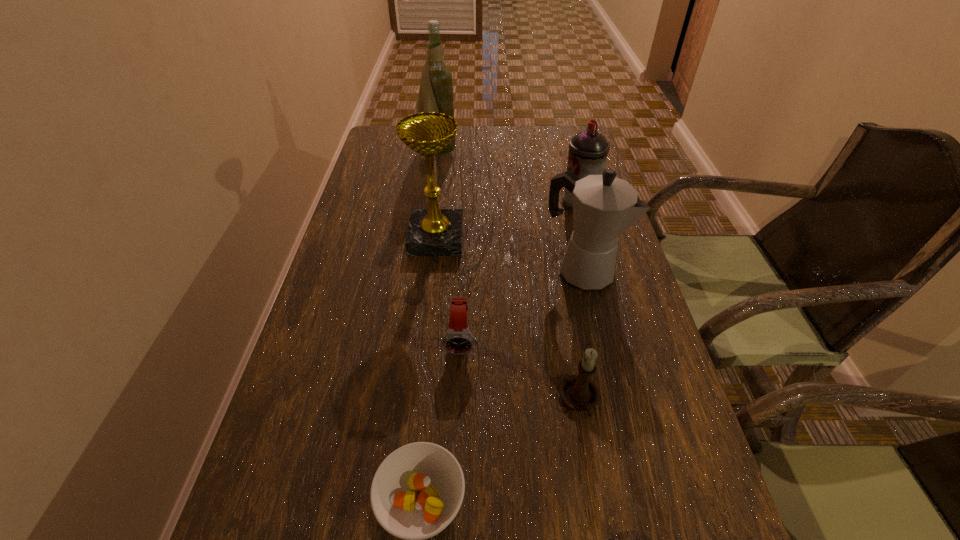
The image size is (960, 540). I want to click on object present at the far left corner, so click(x=436, y=94).

In the image, there is a desktop. Identify the location of vacant space at the far edge. (458, 150).

Locate an element on the screen. The image size is (960, 540). vacant space at the left edge of the desktop is located at coordinates (397, 183).

In the image, there is a desktop. Where is `free region at the right edge`? Image resolution: width=960 pixels, height=540 pixels. free region at the right edge is located at coordinates (646, 389).

Where is `blank region between the aerosol can and the fifth tallest object`? The width and height of the screenshot is (960, 540). blank region between the aerosol can and the fifth tallest object is located at coordinates (579, 302).

Where is `free spot between the award and the third nearest object`? Image resolution: width=960 pixels, height=540 pixels. free spot between the award and the third nearest object is located at coordinates (449, 289).

You are a GUI agent. You are given a task and a screenshot of the screen. Output one action in this format:
    pyautogui.click(x=<x>, y=<y>)
    Task: Click on the vacant region between the second shortest object and the coffeepot
    The image size is (960, 540).
    Given the screenshot: What is the action you would take?
    pyautogui.click(x=521, y=305)

Identify the location of free space between the award and the coffeepot. (509, 254).

Locate an element on the screen. This screenshot has width=960, height=540. empty location between the coffeepot and the wine bottle is located at coordinates (509, 212).

At what (x,y) coordinates should I click in order to perform the action: click on the third closest object relative to the third nearest object. Please return your answer as a coordinate pair (x, y). This screenshot has height=540, width=960. Looking at the image, I should click on (416, 492).